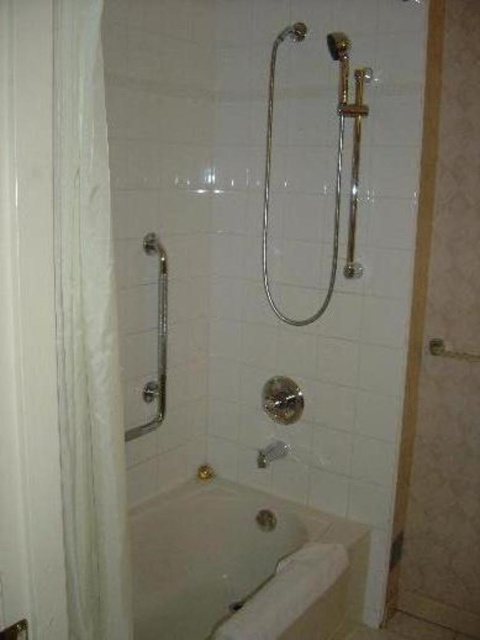
You are a person with limited mobility who needs to reach the silver metallic shower head at upper center while standing next to the white glossy bathtub at lower center. Given that your arm can extend 28 inches, can you safely reach the shower head without overreaching?

The white glossy bathtub at lower center is 33.03 inches away from the silver metallic shower head at upper center. Since your arm can only extend 28 inches, you cannot safely reach the shower head without overreaching.

You are standing in the bathroom and want to determine which of the two points, point (337, 561) or point (266, 227), is nearer to you. Based on the scene description, which point is closer?

Point (337, 561) is closer to the viewer than point (266, 227).

You are a contractor measuring the bathroom layout. You have two points marked in the scene, point (269,93) and point (167,317). Which point is nearer to the camera?

Point (269,93) is closer to the camera than point (167,317).